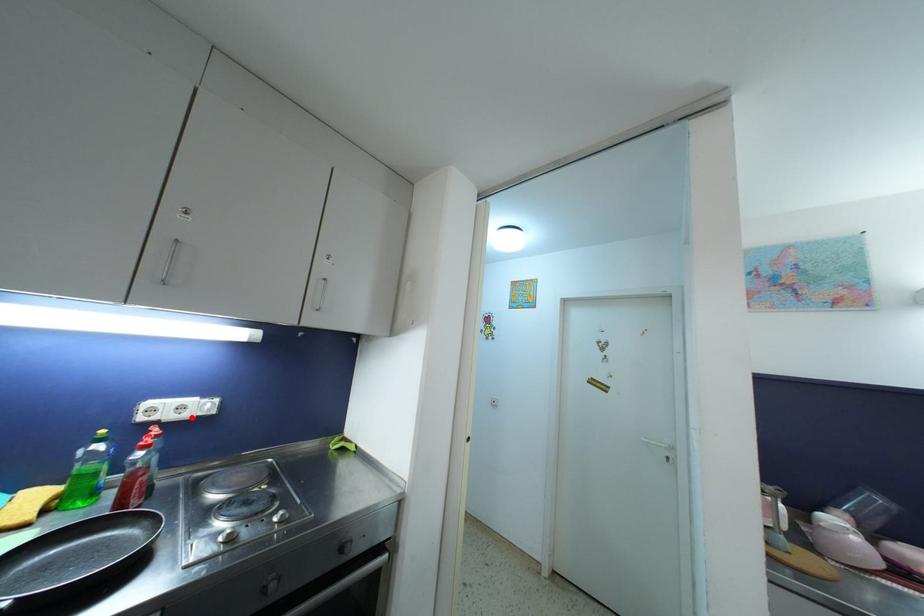
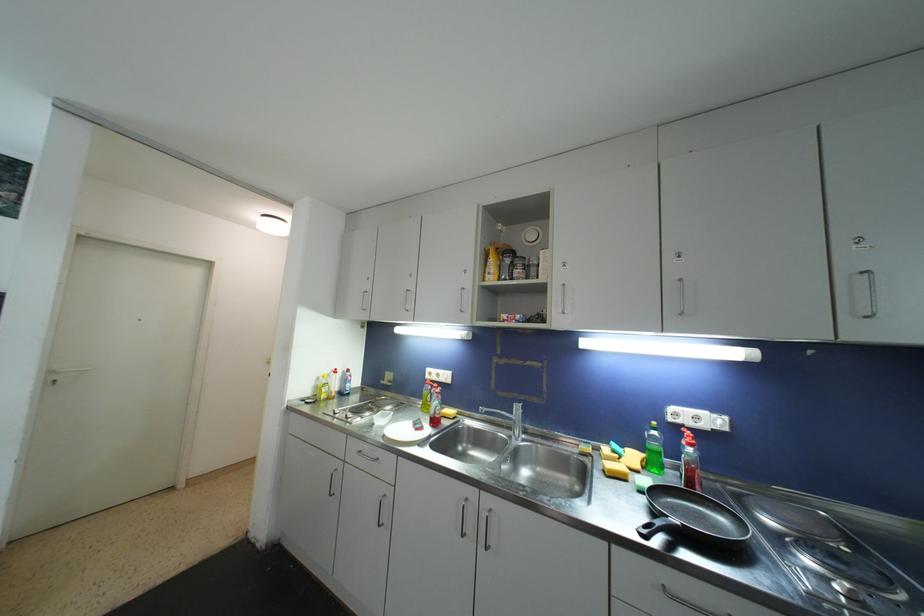
Find the pixel in the second image that matches the highlighted location in the first image.

(708, 429)